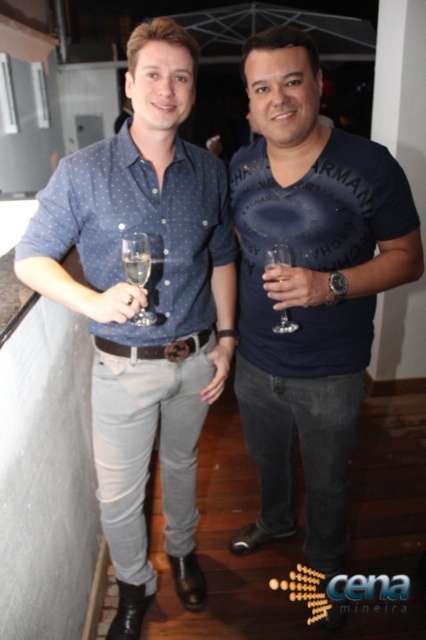
Is point (176, 195) positioned before point (124, 243)?

No, (176, 195) is behind (124, 243).

The width and height of the screenshot is (426, 640). I want to click on matte blue shirt at left, so click(x=144, y=307).

Can you confirm if clear glass wine glass at left is positioned to the right of clear glass wine glass at center?

In fact, clear glass wine glass at left is to the left of clear glass wine glass at center.

In the scene shown: Measure the distance from clear glass wine glass at left to clear glass wine glass at center.

clear glass wine glass at left and clear glass wine glass at center are 12.88 inches apart from each other.

Is point (150, 317) more distant than point (276, 330)?

No, it is in front of (276, 330).

The width and height of the screenshot is (426, 640). Find the location of `clear glass wine glass at left`. clear glass wine glass at left is located at coordinates (135, 257).

Is dark blue cotton t-shirt at center to the left of clear glass wine glass at left from the viewer's perspective?

In fact, dark blue cotton t-shirt at center is to the right of clear glass wine glass at left.

Does dark blue cotton t-shirt at center have a larger size compared to clear glass wine glass at left?

Correct, dark blue cotton t-shirt at center is larger in size than clear glass wine glass at left.

Describe the element at coordinates (308, 289) in the screenshot. I see `dark blue cotton t-shirt at center` at that location.

You are a GUI agent. You are given a task and a screenshot of the screen. Output one action in this format:
    pyautogui.click(x=<x>, y=<y>)
    Task: Click on the dark blue cotton t-shirt at center
    This screenshot has height=640, width=426.
    Given the screenshot: What is the action you would take?
    pyautogui.click(x=308, y=289)